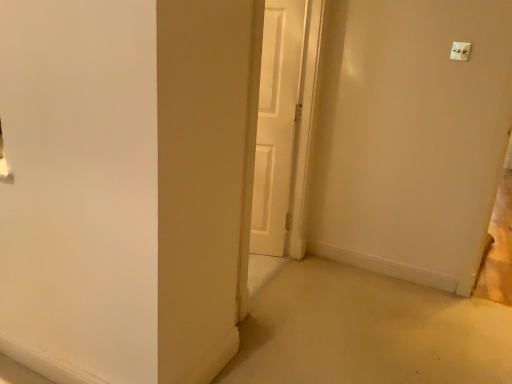
What is the approximate width of white plastic light switch at upper right?

It is 1.78 inches.

Where is `white plastic light switch at upper right`? The width and height of the screenshot is (512, 384). white plastic light switch at upper right is located at coordinates (460, 51).

This screenshot has height=384, width=512. Describe the element at coordinates (460, 51) in the screenshot. I see `white plastic light switch at upper right` at that location.

Describe the element at coordinates (277, 123) in the screenshot. I see `white matte door at center` at that location.

Identify the location of white matte door at center. The height and width of the screenshot is (384, 512). (277, 123).

Where is `white plastic light switch at upper right`? white plastic light switch at upper right is located at coordinates (460, 51).

Considering the relative positions of white plastic light switch at upper right and white matte door at center in the image provided, is white plastic light switch at upper right to the right of white matte door at center from the viewer's perspective?

Correct, you'll find white plastic light switch at upper right to the right of white matte door at center.

Considering their positions, is white plastic light switch at upper right located in front of or behind white matte door at center?

white plastic light switch at upper right is in front of white matte door at center.

Is point (456, 53) closer to viewer compared to point (274, 44)?

Yes.

From the image's perspective, is white plastic light switch at upper right positioned above or below white matte door at center?

white plastic light switch at upper right is above white matte door at center.

From a real-world perspective, does white plastic light switch at upper right sit lower than white matte door at center?

Incorrect, from a real-world perspective, white plastic light switch at upper right is higher than white matte door at center.

Can you confirm if white plastic light switch at upper right is wider than white matte door at center?

Indeed, white plastic light switch at upper right has a greater width compared to white matte door at center.

Is white plastic light switch at upper right taller or shorter than white matte door at center?

Considering their sizes, white plastic light switch at upper right has less height than white matte door at center.

Considering the sizes of white plastic light switch at upper right and white matte door at center in the image, is white plastic light switch at upper right bigger or smaller than white matte door at center?

Clearly, white plastic light switch at upper right is smaller in size than white matte door at center.

Is white plastic light switch at upper right surrounding white matte door at center?

No, white plastic light switch at upper right does not contain white matte door at center.

Is white plastic light switch at upper right placed right next to white matte door at center?

white plastic light switch at upper right and white matte door at center are not in contact.

Could you tell me if white plastic light switch at upper right is facing white matte door at center?

No, white plastic light switch at upper right does not turn towards white matte door at center.

This screenshot has width=512, height=384. In the image, there is a white plastic light switch at upper right. Identify the location of door below it (from the image's perspective). (277, 123).

Consider the image. Is white matte door at center at the right side of white plastic light switch at upper right?

Incorrect, white matte door at center is not on the right side of white plastic light switch at upper right.

Between white matte door at center and white plastic light switch at upper right, which one is positioned behind?

white matte door at center is behind.

Considering the positions of point (271, 186) and point (459, 51), is point (271, 186) closer or farther from the camera than point (459, 51)?

Point (271, 186).

From the image's perspective, which one is positioned lower, white matte door at center or white plastic light switch at upper right?

From the image's view, white matte door at center is below.

Looking at this image, from a real-world perspective, is white matte door at center physically below white plastic light switch at upper right?

Yes, from a real-world perspective, white matte door at center is under white plastic light switch at upper right.

Considering the sizes of objects white matte door at center and white plastic light switch at upper right in the image provided, who is wider, white matte door at center or white plastic light switch at upper right?

white plastic light switch at upper right.

Considering the sizes of objects white matte door at center and white plastic light switch at upper right in the image provided, who is shorter, white matte door at center or white plastic light switch at upper right?

Standing shorter between the two is white plastic light switch at upper right.

Does white matte door at center have a larger size compared to white plastic light switch at upper right?

Yes.

Would you say white matte door at center is outside white plastic light switch at upper right?

Yes, white matte door at center is located beyond the bounds of white plastic light switch at upper right.

Are white matte door at center and white plastic light switch at upper right making contact?

No, white matte door at center is not beside white plastic light switch at upper right.

In the scene shown: Is white matte door at center oriented away from white plastic light switch at upper right?

No, white plastic light switch at upper right is not at the back of white matte door at center.

Image resolution: width=512 pixels, height=384 pixels. What are the coordinates of `door that appears below the white plastic light switch at upper right (from a real-world perspective)` in the screenshot? It's located at (277, 123).

This screenshot has width=512, height=384. Identify the location of light switch positioned vertically above the white matte door at center (from a real-world perspective). (460, 51).

Image resolution: width=512 pixels, height=384 pixels. Find the location of `door to the left of white plastic light switch at upper right`. door to the left of white plastic light switch at upper right is located at coordinates (277, 123).